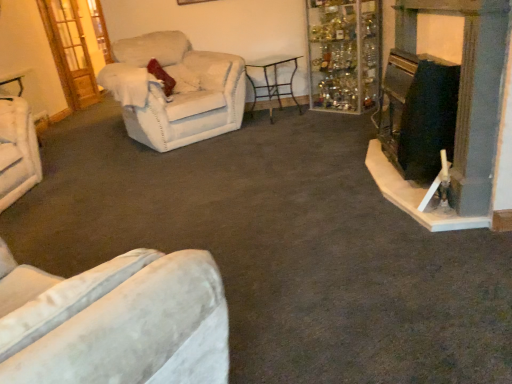
What do you see at coordinates (344, 54) in the screenshot?
I see `clear glass cabinet at upper right` at bounding box center [344, 54].

Locate an element on the screen. The width and height of the screenshot is (512, 384). clear glass cabinet at upper right is located at coordinates (344, 54).

The image size is (512, 384). Describe the element at coordinates (70, 51) in the screenshot. I see `wooden door at upper left` at that location.

This screenshot has width=512, height=384. Describe the element at coordinates (175, 90) in the screenshot. I see `beige fabric armchair at left, the 2th chair when ordered from left to right` at that location.

Looking at this image, measure the distance between point (190, 84) and camera.

Point (190, 84) and camera are 3.98 meters apart.

Describe the element at coordinates (457, 114) in the screenshot. I see `black matte fireplace at right` at that location.

Image resolution: width=512 pixels, height=384 pixels. Identify the location of metallic black table at center. (272, 81).

What are the coordinates of `clear glass cabinet at upper right` in the screenshot? It's located at (344, 54).

Considering the positions of points (72, 105) and (154, 86), is point (72, 105) farther from camera compared to point (154, 86)?

Yes, point (72, 105) is farther from viewer.

From a real-world perspective, which object rests below the other?

beige fabric armchair at left, the 2th chair when ordered from left to right.

Is wooden door at upper left positioned behind beige fabric armchair at left, the 2th chair when ordered from left to right?

Yes, it is behind beige fabric armchair at left, the 2th chair when ordered from left to right.

From the image's perspective, between wooden door at upper left and beige fabric armchair at left, the first chair viewed from the right, who is located below?

From the image's view, beige fabric armchair at left, the first chair viewed from the right, is below.

Does point (219, 123) appear closer or farther from the camera than point (63, 23)?

Clearly, point (219, 123) is closer to the camera than point (63, 23).

How different are the orientations of beige fabric armchair at left, the 2th chair when ordered from left to right, and wooden door at upper left in degrees?

The angular difference between beige fabric armchair at left, the 2th chair when ordered from left to right, and wooden door at upper left is 34.3 degrees.

Which object is thinner, beige fabric armchair at left, the 2th chair when ordered from left to right, or wooden door at upper left?

With smaller width is wooden door at upper left.

Is beige fabric armchair at left, the first chair viewed from the right, facing towards wooden door at upper left?

No, beige fabric armchair at left, the first chair viewed from the right, is not facing towards wooden door at upper left.

Looking at this image, is clear glass cabinet at upper right touching velvet beige armchair at left, the second chair viewed from the right?

clear glass cabinet at upper right and velvet beige armchair at left, the second chair viewed from the right, are clearly separated.

Does point (321, 15) appear closer or farther from the camera than point (19, 139)?

Point (321, 15) is positioned farther from the camera compared to point (19, 139).

Is clear glass cabinet at upper right further to camera compared to velvet beige armchair at left, the second chair viewed from the right?

Yes, it is behind velvet beige armchair at left, the second chair viewed from the right.

Who is taller, clear glass cabinet at upper right or velvet beige armchair at left, which is the first chair in left-to-right order?

clear glass cabinet at upper right.

Can you confirm if black matte fireplace at right is shorter than metallic black table at center?

In fact, black matte fireplace at right may be taller than metallic black table at center.

Is black matte fireplace at right thinner than metallic black table at center?

Yes.

Is black matte fireplace at right to the left or to the right of metallic black table at center in the image?

Based on their positions, black matte fireplace at right is located to the right of metallic black table at center.

Is wooden door at upper left positioned with its back to black matte fireplace at right?

wooden door at upper left is not turned away from black matte fireplace at right.

Which object is positioned more to the left, wooden door at upper left or black matte fireplace at right?

wooden door at upper left is more to the left.

Considering the sizes of wooden door at upper left and black matte fireplace at right in the image, is wooden door at upper left bigger or smaller than black matte fireplace at right?

Considering their sizes, wooden door at upper left takes up less space than black matte fireplace at right.

In the scene shown: From a real-world perspective, which object rests below the other?

black matte fireplace at right, from a real-world perspective.

How many degrees apart are the facing directions of clear glass cabinet at upper right and metallic black table at center?

The angular difference between clear glass cabinet at upper right and metallic black table at center is 69.5 degrees.

Which of these two, clear glass cabinet at upper right or metallic black table at center, stands taller?

clear glass cabinet at upper right is taller.

From a real-world perspective, is clear glass cabinet at upper right positioned above or below metallic black table at center?

In terms of real-world spatial position, clear glass cabinet at upper right is above metallic black table at center.

Considering the relative sizes of metallic black table at center and wooden door at upper left in the image provided, is metallic black table at center smaller than wooden door at upper left?

No, metallic black table at center is not smaller than wooden door at upper left.

Does point (296, 61) come behind point (66, 40)?

No, (296, 61) is closer to viewer.

In the scene shown: Considering the relative positions of metallic black table at center and wooden door at upper left in the image provided, is metallic black table at center to the left or to the right of wooden door at upper left?

In the image, metallic black table at center appears on the right side of wooden door at upper left.

From a real-world perspective, does metallic black table at center stand above wooden door at upper left?

No, from a real-world perspective, metallic black table at center is not above wooden door at upper left.

Where is `the 2nd chair in front of the wooden door at upper left, counting from the anchor's position`? the 2nd chair in front of the wooden door at upper left, counting from the anchor's position is located at coordinates (175, 90).

Find the location of a particular element. The height and width of the screenshot is (384, 512). the 1st chair directly beneath the wooden door at upper left (from a real-world perspective) is located at coordinates (175, 90).

Considering their positions, is beige fabric armchair at left, the first chair viewed from the right, positioned closer to wooden door at upper left than black matte fireplace at right?

The object closer to wooden door at upper left is beige fabric armchair at left, the first chair viewed from the right.

Based on their spatial positions, is velvet beige armchair at left, the second chair viewed from the right, or wooden door at upper left further from beige fabric armchair at left, the first chair viewed from the right?

Among the two, wooden door at upper left is located further to beige fabric armchair at left, the first chair viewed from the right.

When comparing their distances from velvet beige armchair at left, the second chair viewed from the right, does beige fabric armchair at left, the 2th chair when ordered from left to right, or clear glass cabinet at upper right seem closer?

The object closer to velvet beige armchair at left, the second chair viewed from the right, is beige fabric armchair at left, the 2th chair when ordered from left to right.

Estimate the real-world distances between objects in this image. Which object is closer to velvet beige armchair at left, which is the first chair in left-to-right order, metallic black table at center or beige fabric armchair at left, the first chair viewed from the right?

beige fabric armchair at left, the first chair viewed from the right, lies closer to velvet beige armchair at left, which is the first chair in left-to-right order, than the other object.

From the image, which object appears to be nearer to velvet beige armchair at left, which is the first chair in left-to-right order, clear glass cabinet at upper right or metallic black table at center?

metallic black table at center is positioned closer to the anchor velvet beige armchair at left, which is the first chair in left-to-right order.

Considering their positions, is wooden door at upper left positioned closer to black matte fireplace at right than clear glass cabinet at upper right?

clear glass cabinet at upper right lies closer to black matte fireplace at right than the other object.

Looking at the image, which one is located closer to black matte fireplace at right, velvet beige armchair at left, which is the first chair in left-to-right order, or wooden door at upper left?

velvet beige armchair at left, which is the first chair in left-to-right order, is positioned closer to the anchor black matte fireplace at right.

Which object lies further to the anchor point black matte fireplace at right, velvet beige armchair at left, the second chair viewed from the right, or beige fabric armchair at left, the 2th chair when ordered from left to right?

velvet beige armchair at left, the second chair viewed from the right, is positioned further to the anchor black matte fireplace at right.

Image resolution: width=512 pixels, height=384 pixels. I want to click on shelf between velvet beige armchair at left, which is the first chair in left-to-right order, and black matte fireplace at right, in the horizontal direction, so click(x=344, y=54).

This screenshot has height=384, width=512. I want to click on chair between beige fabric armchair at left, the first chair viewed from the right, and wooden door at upper left, along the z-axis, so click(x=17, y=151).

Where is `chair situated between velvet beige armchair at left, the second chair viewed from the right, and black matte fireplace at right from left to right`? This screenshot has height=384, width=512. chair situated between velvet beige armchair at left, the second chair viewed from the right, and black matte fireplace at right from left to right is located at coordinates (175, 90).

This screenshot has width=512, height=384. Identify the location of table located between velvet beige armchair at left, the second chair viewed from the right, and clear glass cabinet at upper right in the left-right direction. (272, 81).